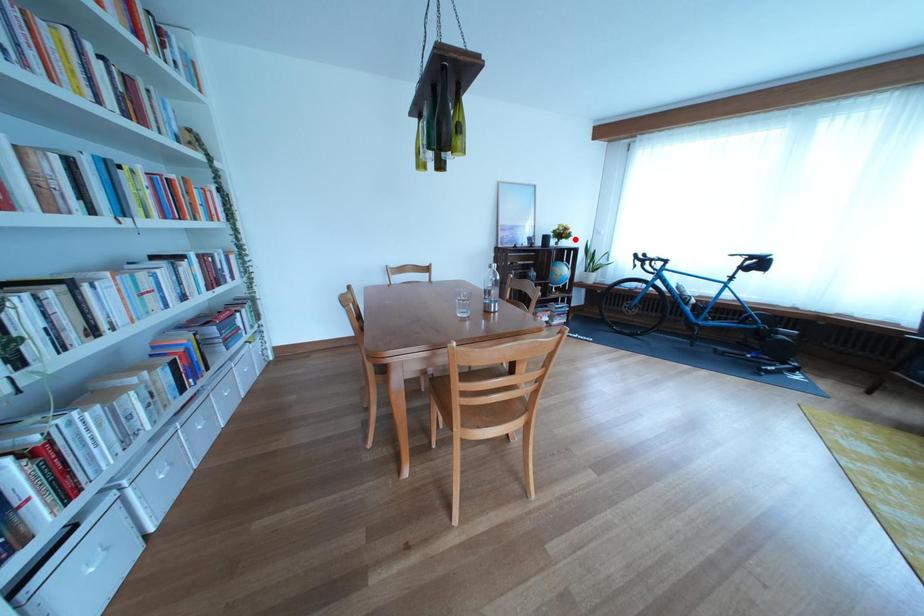
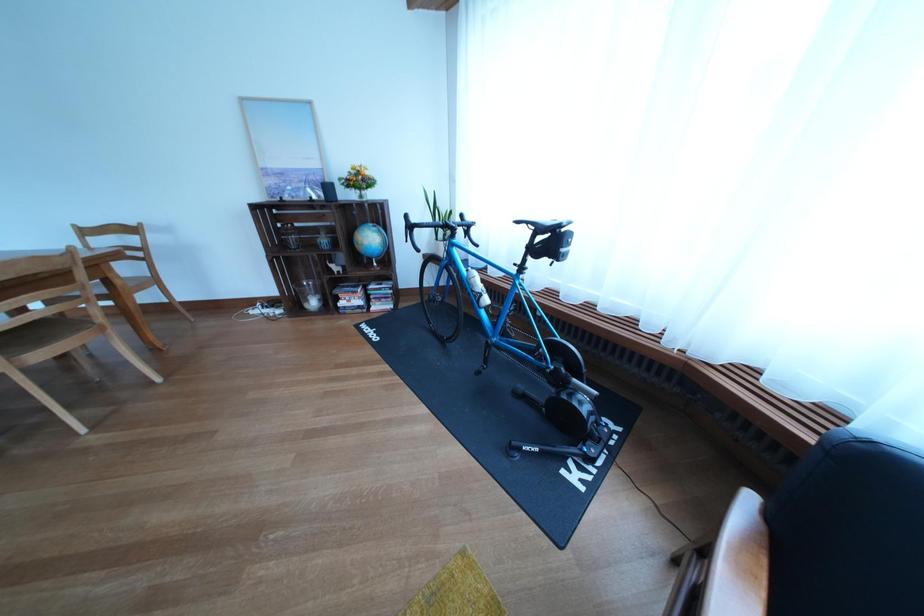
Find the pixel in the second image that matches the highlighted location in the first image.

(372, 185)